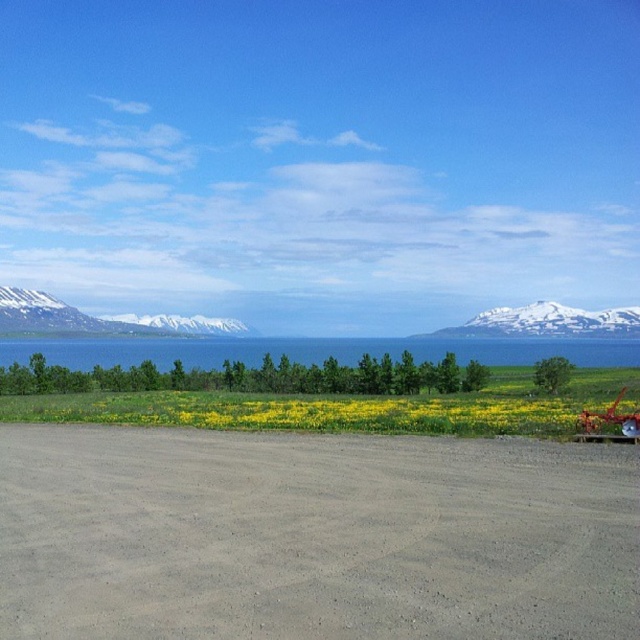
You are standing at the edge of the gray gravel dirt track at center. Can you see the line of small leafy trees beyond the yellow flower field?

Yes, the gray gravel dirt track at center is located at point (x=314, y=531), so you can see the line of small leafy trees beyond the yellow flower field.